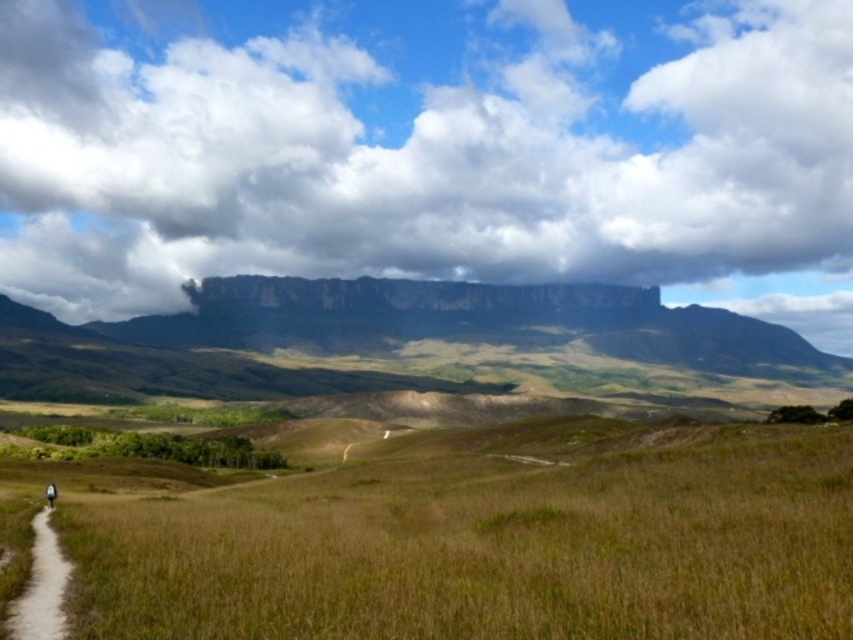
Can you confirm if brown dry grass at lower center is wider than brown dirt path at lower left?

Correct, the width of brown dry grass at lower center exceeds that of brown dirt path at lower left.

At what (x,y) coordinates should I click in order to perform the action: click on brown dry grass at lower center. Please return your answer as a coordinate pair (x, y). The width and height of the screenshot is (853, 640). Looking at the image, I should click on (489, 540).

Image resolution: width=853 pixels, height=640 pixels. Identify the location of brown dry grass at lower center. (489, 540).

Can you confirm if cloudy sky at upper center is smaller than brown dry grass at lower center?

No, cloudy sky at upper center is not smaller than brown dry grass at lower center.

Can you confirm if cloudy sky at upper center is taller than brown dry grass at lower center?

Correct, cloudy sky at upper center is much taller as brown dry grass at lower center.

I want to click on cloudy sky at upper center, so click(425, 147).

This screenshot has width=853, height=640. What are the coordinates of `cloudy sky at upper center` in the screenshot? It's located at (425, 147).

Does cloudy sky at upper center have a smaller size compared to brown dirt path at lower left?

Actually, cloudy sky at upper center might be larger than brown dirt path at lower left.

Can you confirm if cloudy sky at upper center is positioned below brown dirt path at lower left?

No, cloudy sky at upper center is not below brown dirt path at lower left.

Does point (500, 20) lie behind point (67, 576)?

Yes.

Find the location of a particular element. The height and width of the screenshot is (640, 853). cloudy sky at upper center is located at coordinates (425, 147).